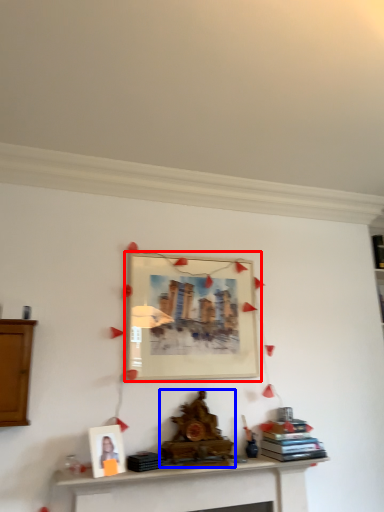
Question: Which point is closer to the camera, picture frame (highlighted by a red box) or fireplace (highlighted by a blue box)?

Choices:
 (A) picture frame
 (B) fireplace

Answer: (B)